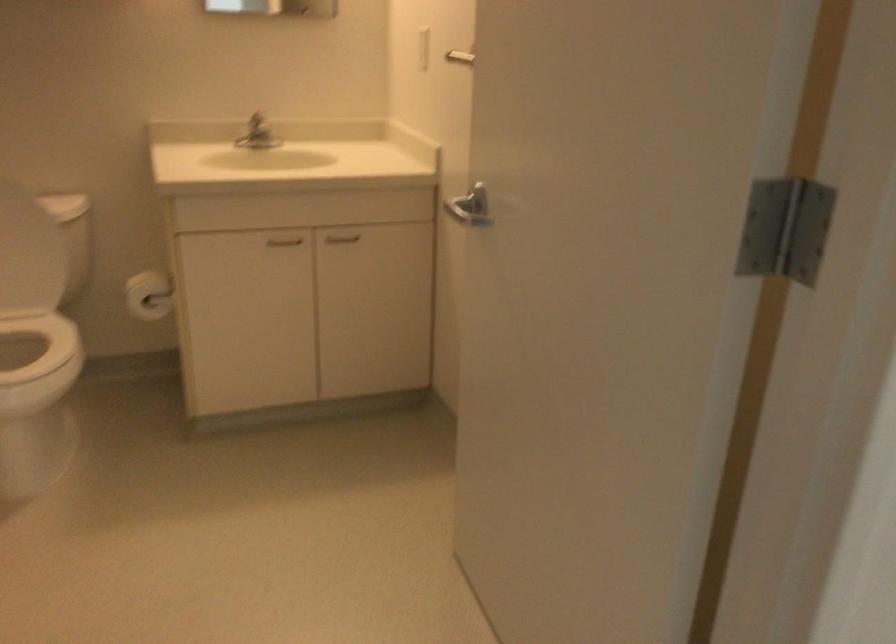
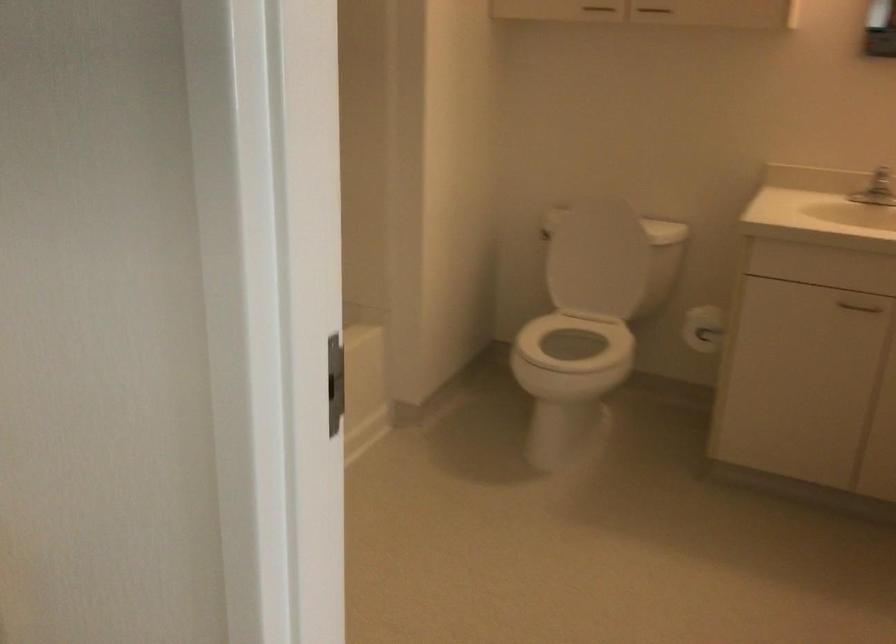
Find the pixel in the second image that matches (x=151, y=290) in the first image.

(702, 328)